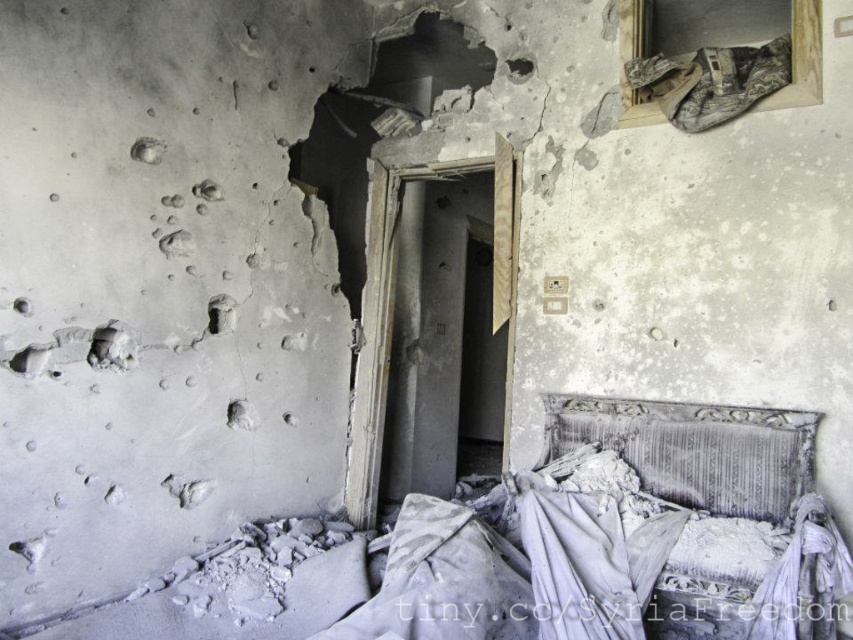
Question: Can you confirm if charred fabric bed at lower right is bigger than worn fabric pillow at lower right?

Choices:
 (A) no
 (B) yes

Answer: (B)

Question: Which object is farther from the camera taking this photo?

Choices:
 (A) charred fabric bed at lower right
 (B) worn fabric pillow at lower right

Answer: (B)

Question: Which object is farther from the camera taking this photo?

Choices:
 (A) charred fabric bed at lower right
 (B) worn fabric pillow at lower right

Answer: (B)

Question: Can you confirm if charred fabric bed at lower right is bigger than worn fabric pillow at lower right?

Choices:
 (A) yes
 (B) no

Answer: (A)

Question: Which object appears farthest from the camera in this image?

Choices:
 (A) worn fabric pillow at lower right
 (B) charred fabric bed at lower right

Answer: (A)

Question: Can you confirm if charred fabric bed at lower right is smaller than worn fabric pillow at lower right?

Choices:
 (A) yes
 (B) no

Answer: (B)